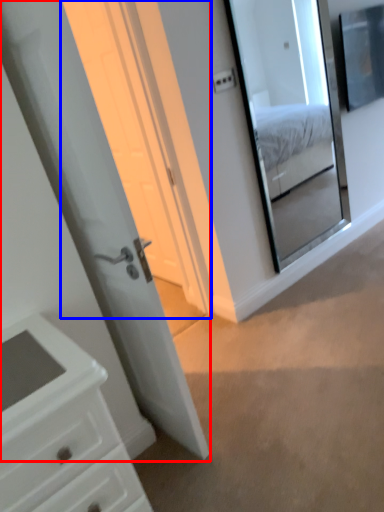
Question: Among these objects, which one is nearest to the camera, door (highlighted by a red box) or screen door (highlighted by a blue box)?

Choices:
 (A) door
 (B) screen door

Answer: (A)